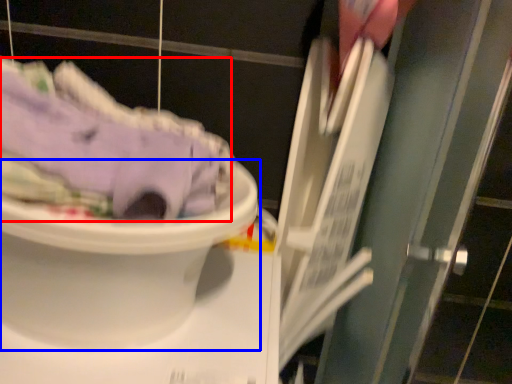
Question: Which point is closer to the camera, clothing (highlighted by a red box) or toilet (highlighted by a blue box)?

Choices:
 (A) clothing
 (B) toilet

Answer: (A)